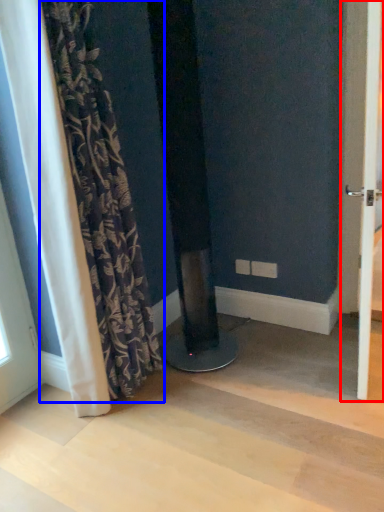
Question: Which object appears closest to the camera in this image, screen door (highlighted by a red box) or curtain (highlighted by a blue box)?

Choices:
 (A) screen door
 (B) curtain

Answer: (A)